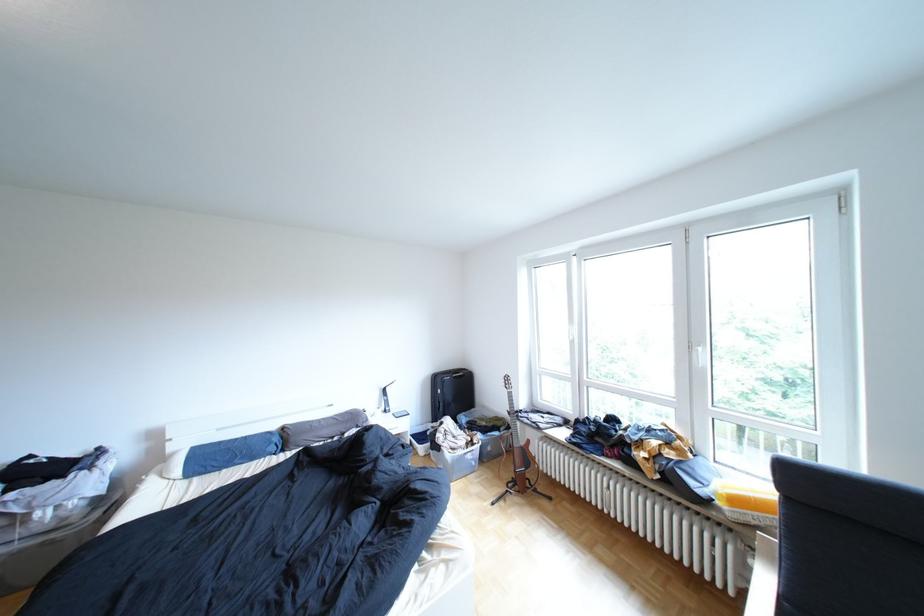
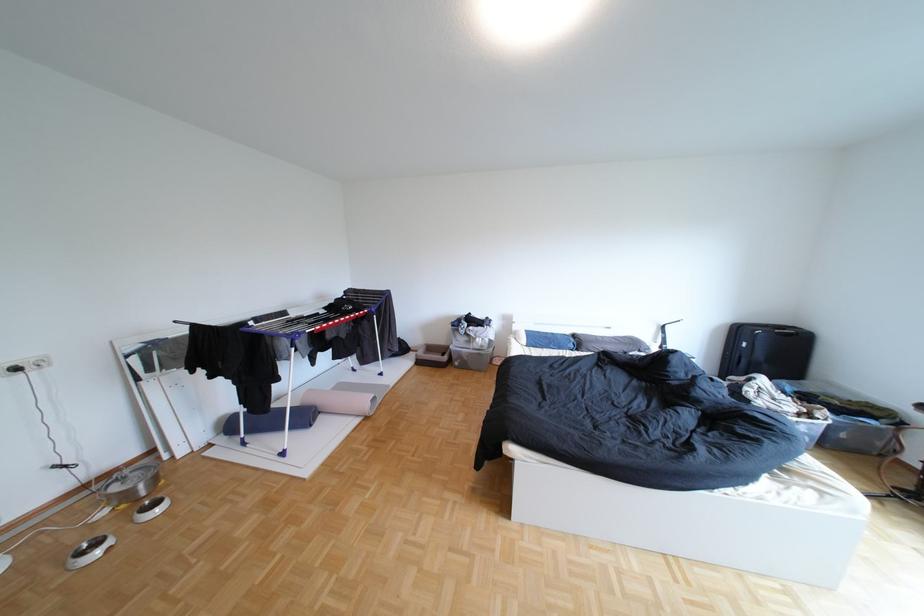
Where in the second image is the point corresponding to [299,429] from the first image?

(590, 336)